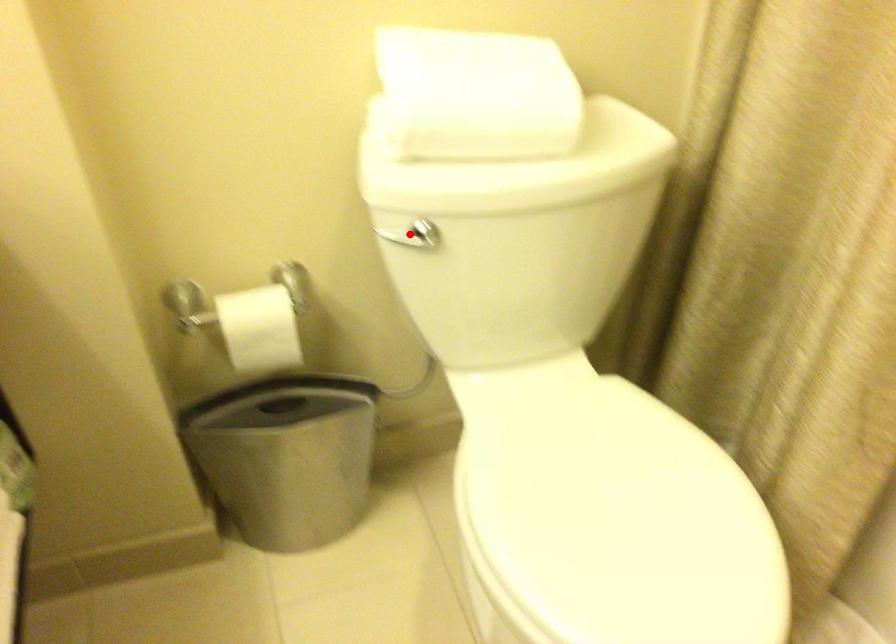
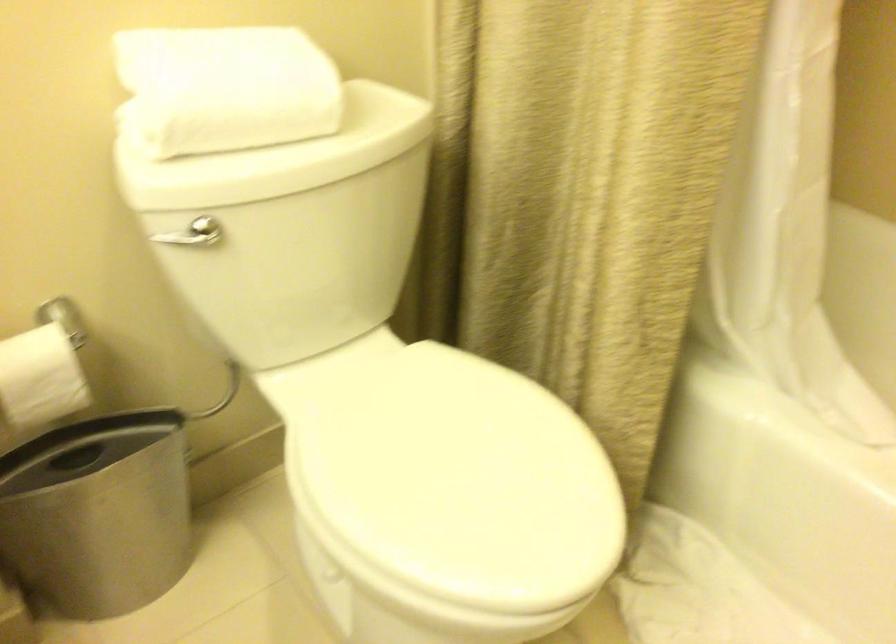
In the second image, find the point that corresponds to the highlighted location in the first image.

(192, 232)